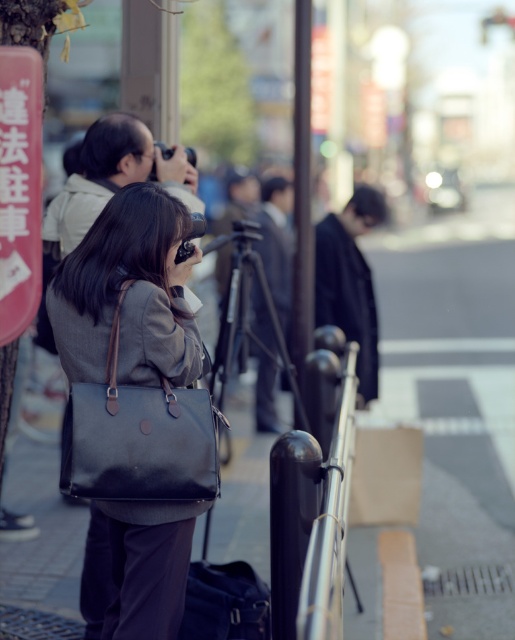
Question: Considering the real-world distances, which object is closest to the matte brown bag at center?

Choices:
 (A) dark brown canvas bag at center
 (B) polished metal railing at center

Answer: (A)

Question: Is dark brown canvas bag at center wider than polished metal railing at center?

Choices:
 (A) no
 (B) yes

Answer: (B)

Question: Which point is farther from the camera taking this photo?

Choices:
 (A) (71, 467)
 (B) (324, 480)

Answer: (B)

Question: Is dark brown canvas bag at center smaller than polished metal railing at center?

Choices:
 (A) no
 (B) yes

Answer: (B)

Question: Does matte brown bag at center have a smaller size compared to polished metal railing at center?

Choices:
 (A) no
 (B) yes

Answer: (B)

Question: Which of the following is the farthest from the observer?

Choices:
 (A) (103, 544)
 (B) (334, 470)

Answer: (A)